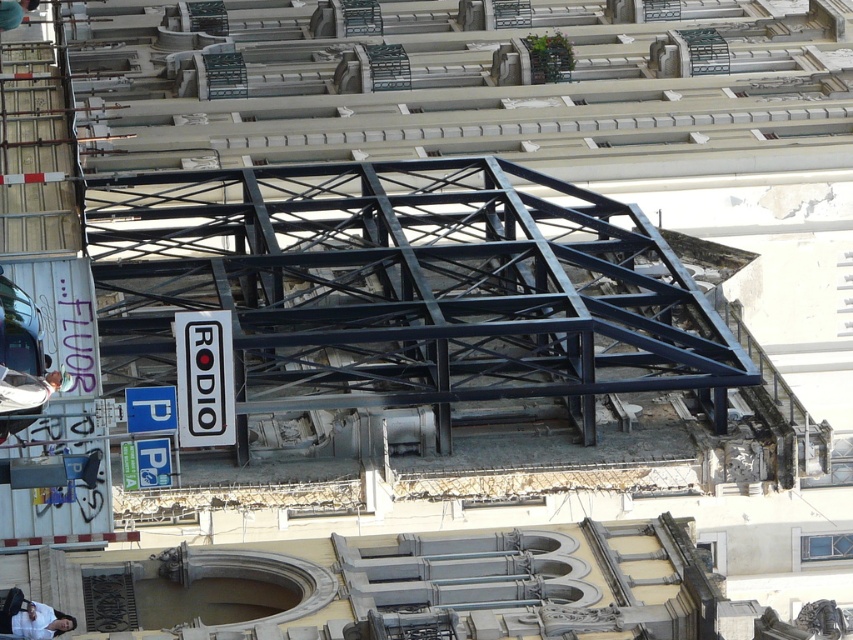
Question: Does white plastic signboard at center appear under white fabric shirt at lower left?

Choices:
 (A) no
 (B) yes

Answer: (A)

Question: Does white fabric shirt at lower left appear over light blue shirt at lower left?

Choices:
 (A) no
 (B) yes

Answer: (B)

Question: Which point is farther from the camera taking this photo?

Choices:
 (A) (285, 390)
 (B) (194, 321)
 (C) (4, 369)
 (D) (4, 632)

Answer: (A)

Question: Estimate the real-world distances between objects in this image. Which object is closer to the black metal framework at center?

Choices:
 (A) light blue shirt at lower left
 (B) white fabric shirt at lower left

Answer: (A)

Question: Can you confirm if white fabric shirt at lower left is positioned to the left of light blue shirt at lower left?

Choices:
 (A) yes
 (B) no

Answer: (B)

Question: Which point is farther to the camera?

Choices:
 (A) white fabric shirt at lower left
 (B) black metal framework at center
 (C) white plastic signboard at center
 (D) light blue shirt at lower left

Answer: (B)